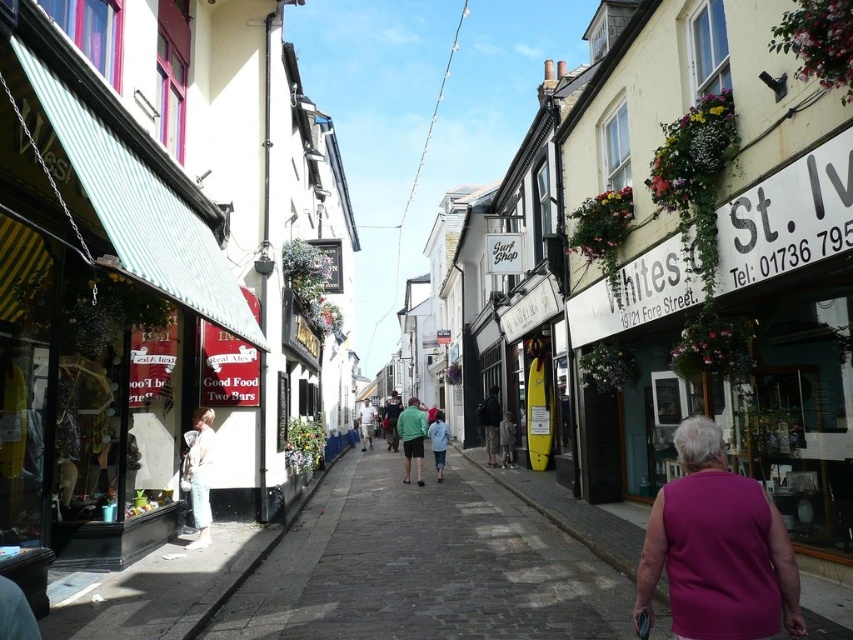
Question: Where is purple sleeveless top at lower right located in relation to green cotton shirt at center in the image?

Choices:
 (A) above
 (B) below

Answer: (A)

Question: Is purple sleeveless top at lower right to the right of light blue denim jacket at center from the viewer's perspective?

Choices:
 (A) yes
 (B) no

Answer: (A)

Question: Which point is farther to the camera?

Choices:
 (A) white cotton dress at left
 (B) purple sleeveless top at lower right

Answer: (A)

Question: Among these points, which one is nearest to the camera?

Choices:
 (A) (192, 504)
 (B) (508, 413)
 (C) (445, 435)

Answer: (A)

Question: Which of the following is the farthest from the observer?

Choices:
 (A) (364, 410)
 (B) (683, 624)

Answer: (A)

Question: Can you confirm if green cotton shirt at center is wider than light blue denim jacket at center?

Choices:
 (A) no
 (B) yes

Answer: (B)